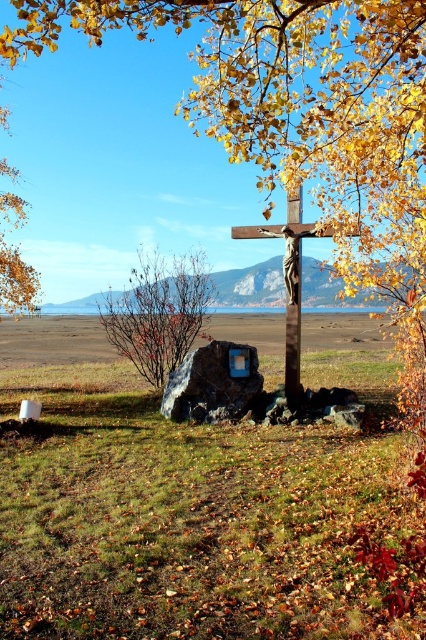
You are standing in front of the crucifix and want to touch both the bare branches at center and the metallic brown cross at center. Which object will you reach first?

You will reach the bare branches at center first because it is closer to you than the metallic brown cross at center.

You are a photographer standing at the base of the crucifix. You want to capture a closeup of the bare branches at center in your shot. Where should you point your camera?

The bare branches at center are located at point (158,314), so you should point your camera towards that coordinate to capture them in your shot.